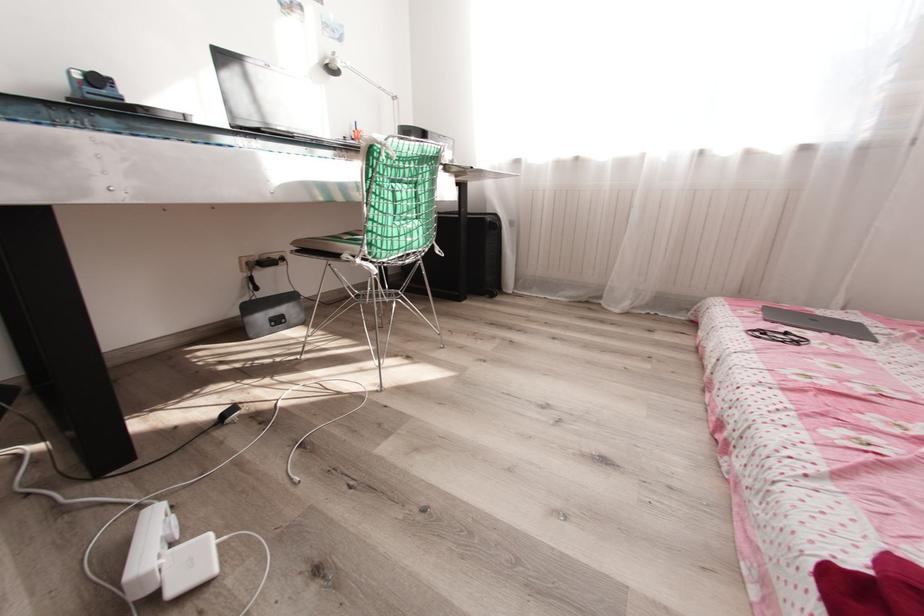
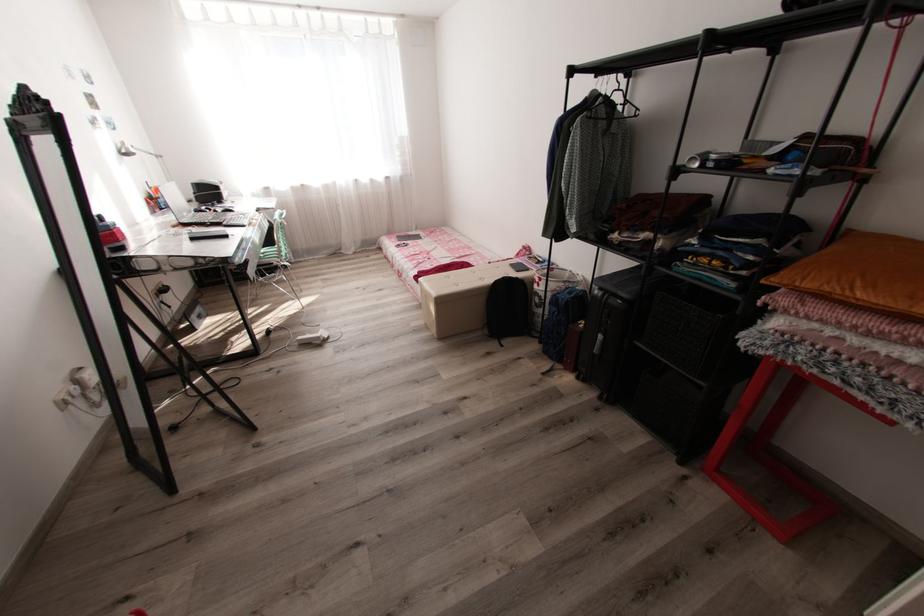
Find the pixel in the second image that matches point 331,63 in the first image.

(129, 151)